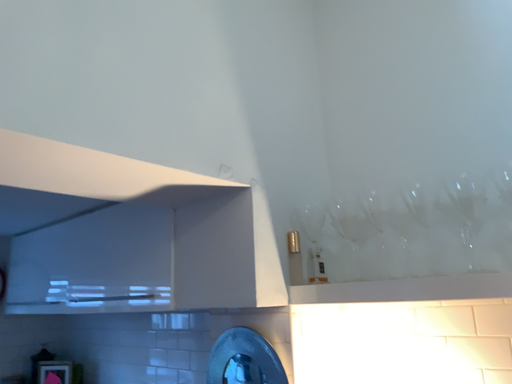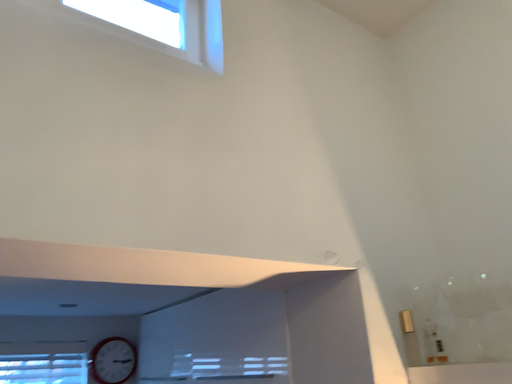
Question: How did the camera likely rotate when shooting the video?

Choices:
 (A) rotated right
 (B) rotated left

Answer: (B)